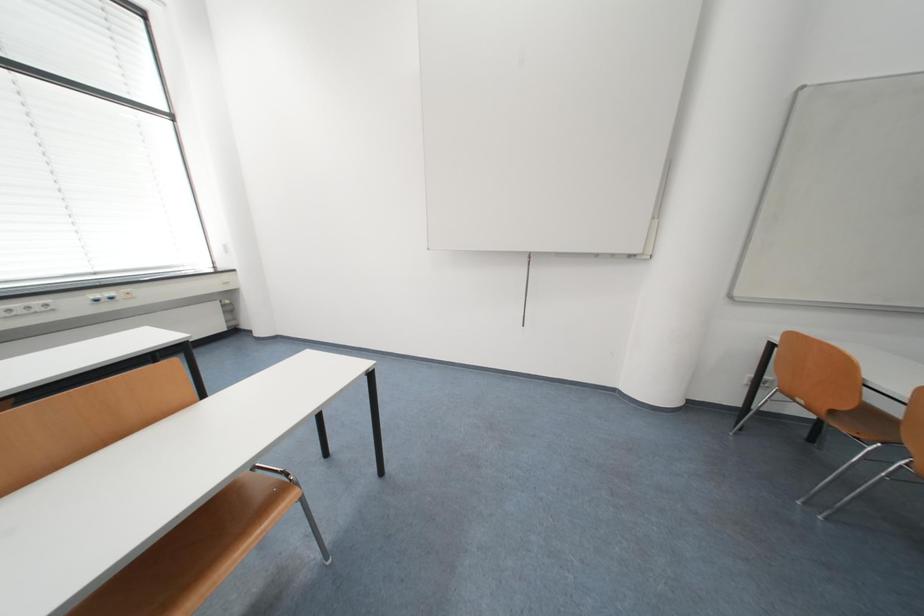
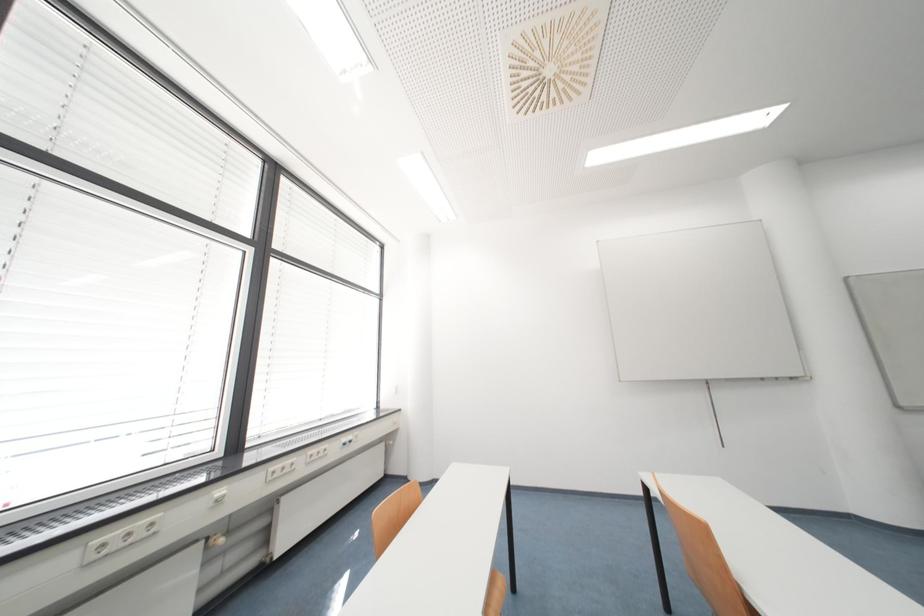
Question: In a continuous first-person perspective shot, in which direction is the camera moving?

Choices:
 (A) Left
 (B) Right
 (C) Forward
 (D) Backward

Answer: (A)